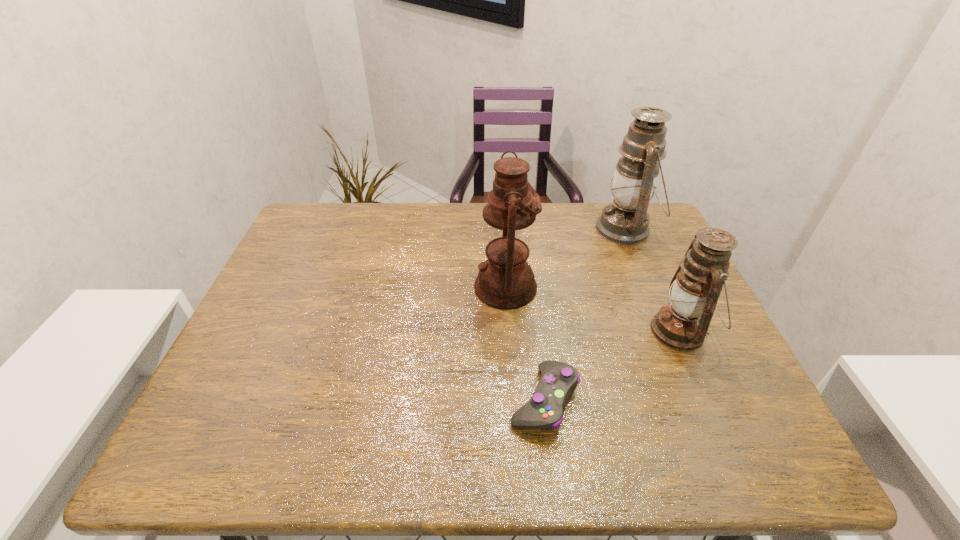
Find the location of a particular element. This screenshot has width=960, height=540. the farthest object is located at coordinates (625, 221).

Where is `the leftmost lantern`? The width and height of the screenshot is (960, 540). the leftmost lantern is located at coordinates (505, 280).

You are a GUI agent. You are given a task and a screenshot of the screen. Output one action in this format:
    pyautogui.click(x=<x>, y=<y>)
    Task: Click on the shortest lantern
    
    Given the screenshot: What is the action you would take?
    pyautogui.click(x=682, y=325)

Where is `the nearest object`? This screenshot has height=540, width=960. the nearest object is located at coordinates (544, 411).

The height and width of the screenshot is (540, 960). In order to click on the shortest object in this screenshot , I will do `click(544, 411)`.

At what (x,y) coordinates should I click in order to perform the action: click on free region located on the left of the farthest object. Please return your answer as a coordinate pair (x, y). This screenshot has height=540, width=960. Looking at the image, I should click on (555, 230).

Identify the location of vacant space located on the right of the leftmost lantern. The width and height of the screenshot is (960, 540). (678, 287).

Identify the location of free spot located on the back of the shortest lantern. (641, 244).

The width and height of the screenshot is (960, 540). What are the coordinates of `vacant region located 0.230m on the right of the shortest object` in the screenshot? It's located at (688, 400).

The height and width of the screenshot is (540, 960). What are the coordinates of `object located in the far edge section of the desktop` in the screenshot? It's located at (625, 221).